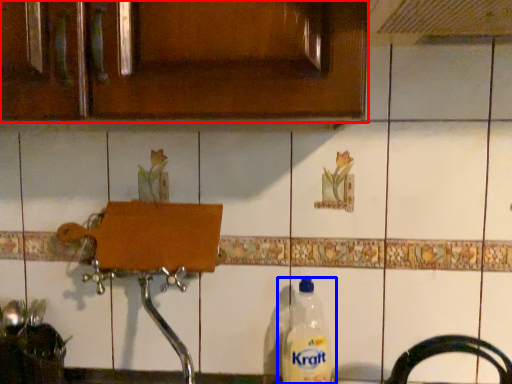
Question: Which point is further to the camera, cabinetry (highlighted by a red box) or bottle (highlighted by a blue box)?

Choices:
 (A) cabinetry
 (B) bottle

Answer: (B)